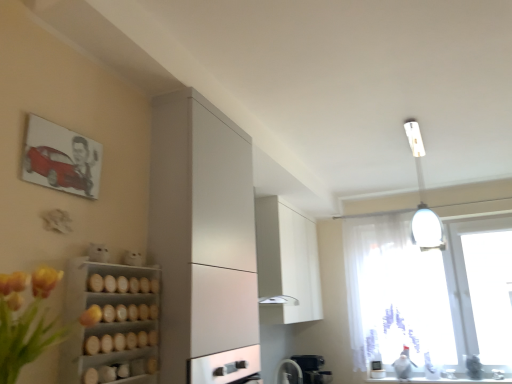
The image size is (512, 384). What are the coordinates of `blank space above wooden shelves at lower left (from a real-world perspective)` in the screenshot? It's located at (117, 261).